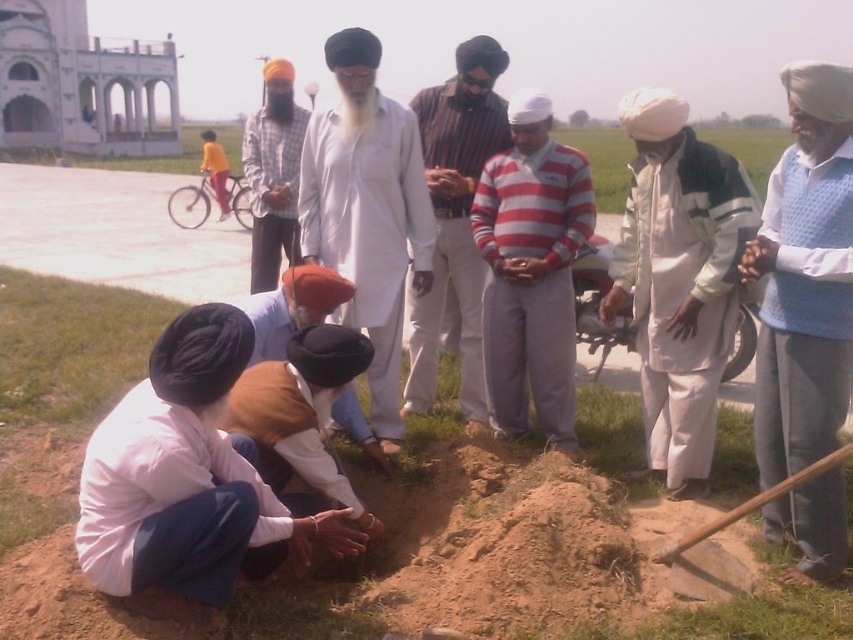
Question: Which point appears farthest from the camera in this image?

Choices:
 (A) (782, 152)
 (B) (831, 464)
 (C) (717, 232)
 (D) (337, 221)

Answer: (A)

Question: Is striped cotton shirt at center to the right of brown cotton turban at lower center from the viewer's perspective?

Choices:
 (A) no
 (B) yes

Answer: (B)

Question: Among these points, which one is farthest from the camera?

Choices:
 (A) (669, 232)
 (B) (463, 131)
 (C) (306, 292)

Answer: (B)

Question: Estimate the real-world distances between objects in this image. Which object is farther from the white matte kurta at center?

Choices:
 (A) white dotted shirt at center
 (B) striped cotton sweater at center
 (C) matte white turban at center

Answer: (C)

Question: Does light pink fabric at lower left have a smaller size compared to wooden shovel at lower center?

Choices:
 (A) yes
 (B) no

Answer: (B)

Question: Does light pink fabric at lower left appear under striped cotton sweater at center?

Choices:
 (A) no
 (B) yes

Answer: (B)